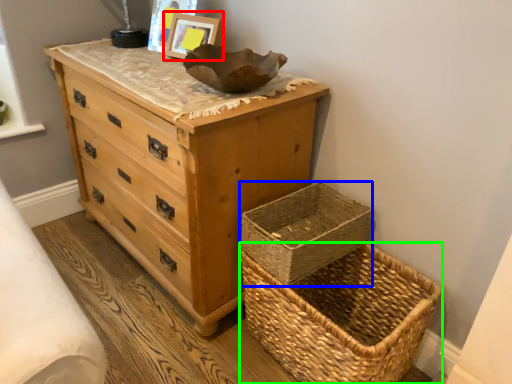
Question: Which object is the closest to the picture frame (highlighted by a red box)? Choose among these: basket container (highlighted by a blue box) or picnic basket (highlighted by a green box).

Choices:
 (A) basket container
 (B) picnic basket

Answer: (A)